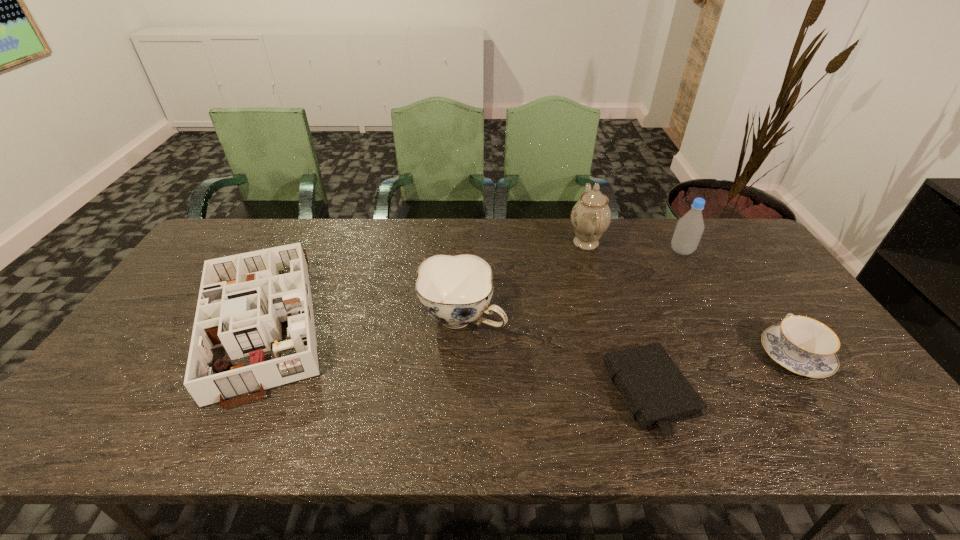
At what (x,y) coordinates should I click in order to perform the action: click on unoccupied position between the shortest object and the second chinaware from right to left. Please return your answer as a coordinate pair (x, y). The height and width of the screenshot is (540, 960). Looking at the image, I should click on (618, 319).

This screenshot has width=960, height=540. Identify the location of object that is the fifth closest to the rightmost chinaware. (243, 300).

Select which object is the second closest to the bottle. Please provide its 2D coordinates. Your answer should be formatted as a tuple, i.e. [(x, y)], where the tuple contains the x and y coordinates of a point satisfying the conditions above.

[(802, 345)]

This screenshot has width=960, height=540. Identify the location of the second closest chinaware relative to the leftmost object. (591, 216).

The width and height of the screenshot is (960, 540). I want to click on the second closest chinaware relative to the fifth object from left to right, so click(802, 345).

The width and height of the screenshot is (960, 540). Identify the location of free point that satisfies the following two spatial constraints: 1. on the front side of the shortest object; 2. on the right side of the leftmost object. (227, 395).

Where is `free location that satisfies the following two spatial constraints: 1. on the spout of the Bible; 2. on the left side of the farthest chinaware`? free location that satisfies the following two spatial constraints: 1. on the spout of the Bible; 2. on the left side of the farthest chinaware is located at coordinates (632, 395).

Locate an element on the screen. Image resolution: width=960 pixels, height=540 pixels. blank area in the image that satisfies the following two spatial constraints: 1. on the back side of the dollhouse; 2. on the right side of the fourth shortest object is located at coordinates (265, 318).

This screenshot has width=960, height=540. What are the coordinates of `blank area in the image that satisfies the following two spatial constraints: 1. on the back side of the fifth object from left to right; 2. on the right side of the shortest object` in the screenshot? It's located at (601, 251).

At what (x,y) coordinates should I click in order to perform the action: click on free location that satisfies the following two spatial constraints: 1. on the back side of the third tallest object; 2. on the left side of the leftmost object. Please return your answer as a coordinate pair (x, y). The height and width of the screenshot is (540, 960). Looking at the image, I should click on (265, 318).